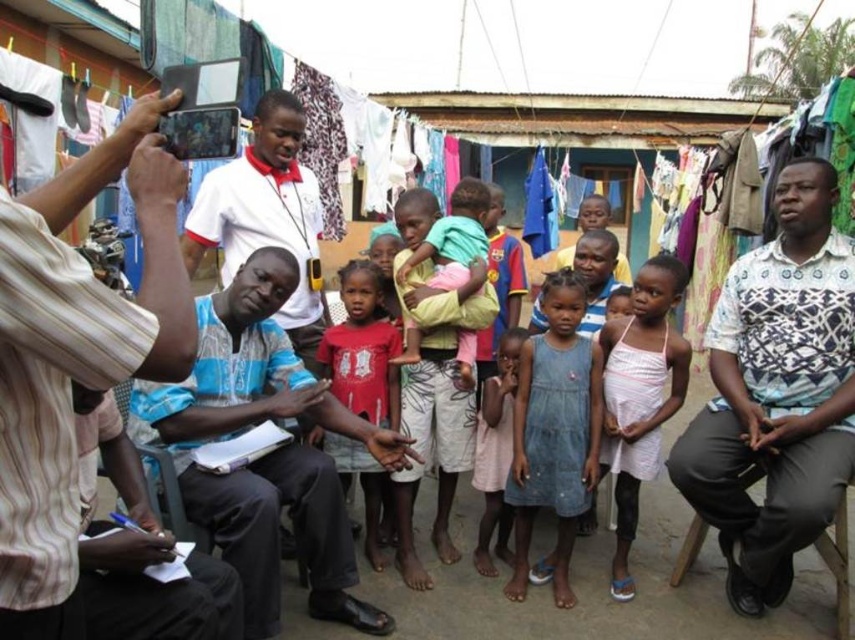
Is striped cotton shirt at left below pink fabric dress at center?

Actually, striped cotton shirt at left is above pink fabric dress at center.

Who is more distant from viewer, (x=50, y=448) or (x=494, y=513)?

The point (x=494, y=513) is behind.

Locate an element on the screen. striped cotton shirt at left is located at coordinates (75, 356).

Can you confirm if striped cotton shirt at left is positioned above denim dress at center?

Correct, striped cotton shirt at left is located above denim dress at center.

From the picture: Who is lower down, striped cotton shirt at left or denim dress at center?

denim dress at center

The height and width of the screenshot is (640, 855). What do you see at coordinates (75, 356) in the screenshot?
I see `striped cotton shirt at left` at bounding box center [75, 356].

You are a GUI agent. You are given a task and a screenshot of the screen. Output one action in this format:
    pyautogui.click(x=<x>, y=<y>)
    Task: Click on the striped cotton shirt at left
    The image size is (855, 640).
    Given the screenshot: What is the action you would take?
    tap(75, 356)

Can you confirm if striped cotton shirt at left is smaller than yellow cotton shirt at center?

No.

Does point (9, 308) lie behind point (398, 358)?

That is False.

Image resolution: width=855 pixels, height=640 pixels. I want to click on striped cotton shirt at left, so click(75, 356).